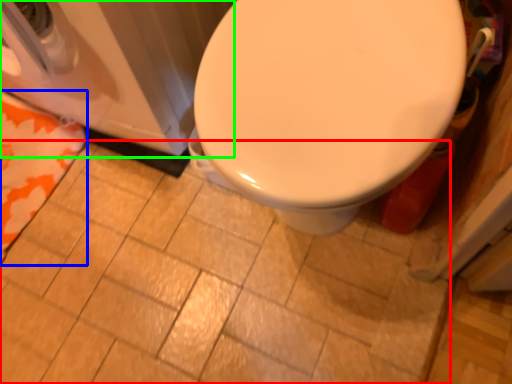
Question: Which object is positioned closest to ceramic tile (highlighted by a red box)? Select from beach towel (highlighted by a blue box) and washer (highlighted by a green box).

Choices:
 (A) beach towel
 (B) washer

Answer: (A)